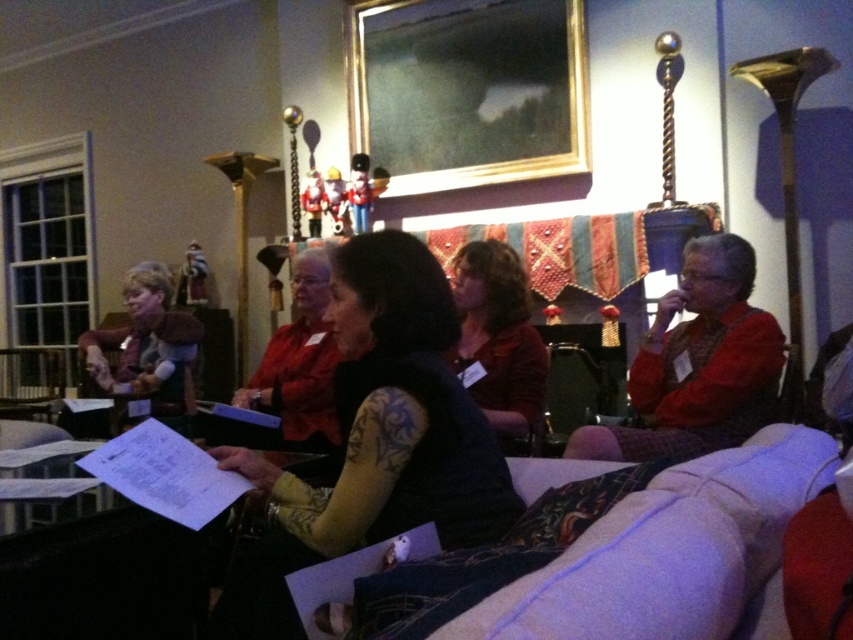
You are sitting at the back of the room and want to see the person wearing the brown textured sweater at center. Is the dark blue fabric at center blocking your view of them?

The dark blue fabric at center is in front of the brown textured sweater at center, so it is blocking the view of the brown textured sweater at center.

You are standing in the room and want to hand a document to the person wearing the brown textured sweater at center. Based on their position, which direction should you walk to reach them?

The brown textured sweater at center is located at point (x=498, y=339), so you should walk towards the center of the room to reach them.